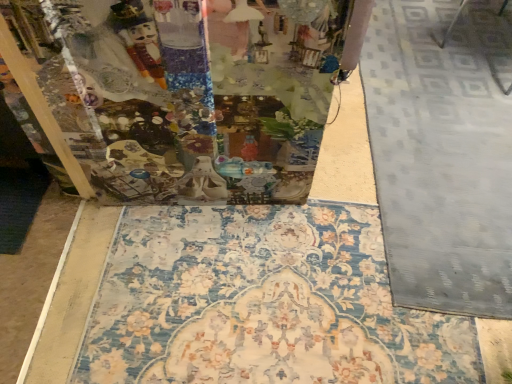
Question: Considering the relative sizes of floral carpet at center and gray textured rug at right in the image provided, is floral carpet at center thinner than gray textured rug at right?

Choices:
 (A) yes
 (B) no

Answer: (B)

Question: Is floral carpet at center bigger than gray textured rug at right?

Choices:
 (A) yes
 (B) no

Answer: (B)

Question: From a real-world perspective, is floral carpet at center located beneath gray textured rug at right?

Choices:
 (A) no
 (B) yes

Answer: (B)

Question: Does floral carpet at center touch gray textured rug at right?

Choices:
 (A) yes
 (B) no

Answer: (B)

Question: Does floral carpet at center come in front of gray textured rug at right?

Choices:
 (A) no
 (B) yes

Answer: (B)

Question: Would you say floral carpet at center is outside gray textured rug at right?

Choices:
 (A) no
 (B) yes

Answer: (B)

Question: Is gray textured rug at right surrounding floral carpet at center?

Choices:
 (A) yes
 (B) no

Answer: (B)

Question: Can you confirm if gray textured rug at right is positioned to the left of floral carpet at center?

Choices:
 (A) yes
 (B) no

Answer: (B)

Question: Is gray textured rug at right completely or partially outside of floral carpet at center?

Choices:
 (A) yes
 (B) no

Answer: (A)

Question: Is gray textured rug at right thinner than floral carpet at center?

Choices:
 (A) no
 (B) yes

Answer: (B)

Question: Is gray textured rug at right far away from floral carpet at center?

Choices:
 (A) yes
 (B) no

Answer: (B)

Question: Is gray textured rug at right bigger than floral carpet at center?

Choices:
 (A) no
 (B) yes

Answer: (B)

Question: Relative to gray textured rug at right, is floral carpet at center in front or behind?

Choices:
 (A) front
 (B) behind

Answer: (A)